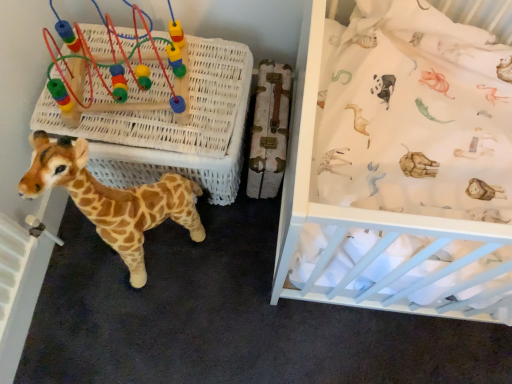
Question: Can you confirm if white wicker basket at center is wider than soft plush giraffe at lower left?

Choices:
 (A) no
 (B) yes

Answer: (B)

Question: Are white wicker basket at center and soft plush giraffe at lower left far apart?

Choices:
 (A) no
 (B) yes

Answer: (A)

Question: Is white wicker basket at center shorter than soft plush giraffe at lower left?

Choices:
 (A) no
 (B) yes

Answer: (B)

Question: Considering the relative positions of white wicker basket at center and soft plush giraffe at lower left in the image provided, is white wicker basket at center to the right of soft plush giraffe at lower left from the viewer's perspective?

Choices:
 (A) no
 (B) yes

Answer: (B)

Question: From a real-world perspective, is white wicker basket at center physically above soft plush giraffe at lower left?

Choices:
 (A) no
 (B) yes

Answer: (A)

Question: Could you tell me if white wicker basket at center is turned towards soft plush giraffe at lower left?

Choices:
 (A) yes
 (B) no

Answer: (A)

Question: From the image's perspective, is soft plush giraffe at lower left located above plastic beads at upper left?

Choices:
 (A) no
 (B) yes

Answer: (A)

Question: Is soft plush giraffe at lower left to the right of plastic beads at upper left from the viewer's perspective?

Choices:
 (A) no
 (B) yes

Answer: (B)

Question: Does soft plush giraffe at lower left have a lesser width compared to plastic beads at upper left?

Choices:
 (A) no
 (B) yes

Answer: (B)

Question: Is soft plush giraffe at lower left positioned with its back to plastic beads at upper left?

Choices:
 (A) yes
 (B) no

Answer: (A)

Question: From a real-world perspective, is soft plush giraffe at lower left positioned under plastic beads at upper left based on gravity?

Choices:
 (A) yes
 (B) no

Answer: (A)

Question: From the image's perspective, does soft plush giraffe at lower left appear lower than plastic beads at upper left?

Choices:
 (A) no
 (B) yes

Answer: (B)

Question: Is white fabric at upper right facing towards soft plush giraffe at lower left?

Choices:
 (A) yes
 (B) no

Answer: (B)